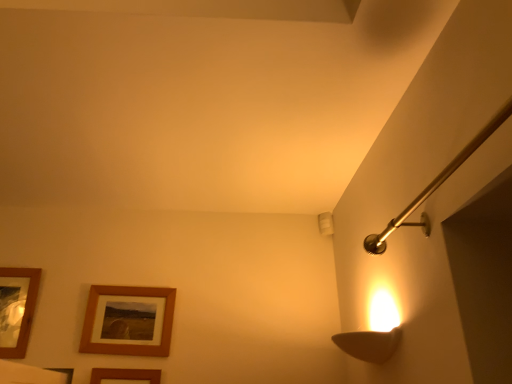
Question: From the image's perspective, would you say brown wooden picture frame at lower left, marked as the third picture frame in a left-to-right arrangement, is positioned over woodenobject at lower left, arranged as the second picture frame when viewed from the right?

Choices:
 (A) yes
 (B) no

Answer: (B)

Question: Can you confirm if brown wooden picture frame at lower left, which appears as the first picture frame when viewed from the right, is positioned to the left of woodenobject at lower left, placed as the 2th picture frame when sorted from left to right?

Choices:
 (A) no
 (B) yes

Answer: (A)

Question: Is woodenobject at lower left, arranged as the second picture frame when viewed from the right, surrounded by brown wooden picture frame at lower left, marked as the third picture frame in a left-to-right arrangement?

Choices:
 (A) no
 (B) yes

Answer: (A)

Question: Does brown wooden picture frame at lower left, marked as the third picture frame in a left-to-right arrangement, lie behind woodenobject at lower left, arranged as the second picture frame when viewed from the right?

Choices:
 (A) no
 (B) yes

Answer: (A)

Question: From a real-world perspective, is brown wooden picture frame at lower left, which appears as the first picture frame when viewed from the right, positioned under woodenobject at lower left, arranged as the second picture frame when viewed from the right, based on gravity?

Choices:
 (A) no
 (B) yes

Answer: (B)

Question: From a real-world perspective, is woodenobject at lower left, placed as the 2th picture frame when sorted from left to right, positioned above or below brown wooden picture frame at lower left, which appears as the first picture frame when viewed from the right?

Choices:
 (A) below
 (B) above

Answer: (B)

Question: In the image, is woodenobject at lower left, placed as the 2th picture frame when sorted from left to right, positioned in front of or behind brown wooden picture frame at lower left, marked as the third picture frame in a left-to-right arrangement?

Choices:
 (A) behind
 (B) front

Answer: (A)

Question: Is woodenobject at lower left, placed as the 2th picture frame when sorted from left to right, to the left or to the right of brown wooden picture frame at lower left, marked as the third picture frame in a left-to-right arrangement, in the image?

Choices:
 (A) left
 (B) right

Answer: (A)

Question: Looking at their shapes, would you say woodenobject at lower left, arranged as the second picture frame when viewed from the right, is wider or thinner than brown wooden picture frame at lower left, marked as the third picture frame in a left-to-right arrangement?

Choices:
 (A) wide
 (B) thin

Answer: (A)

Question: Which is correct: brown wooden picture frame at lower left, which appears as the first picture frame when viewed from the right, is inside woodenobject at lower left, arranged as the second picture frame when viewed from the right, or outside of it?

Choices:
 (A) inside
 (B) outside

Answer: (B)

Question: Is brown wooden picture frame at lower left, marked as the third picture frame in a left-to-right arrangement, to the left or to the right of woodenobject at lower left, arranged as the second picture frame when viewed from the right, in the image?

Choices:
 (A) right
 (B) left

Answer: (A)

Question: Is brown wooden picture frame at lower left, which appears as the first picture frame when viewed from the right, in front of or behind woodenobject at lower left, placed as the 2th picture frame when sorted from left to right, in the image?

Choices:
 (A) behind
 (B) front

Answer: (B)

Question: From the image's perspective, is brown wooden picture frame at lower left, which appears as the first picture frame when viewed from the right, above or below woodenobject at lower left, arranged as the second picture frame when viewed from the right?

Choices:
 (A) above
 (B) below

Answer: (B)

Question: From the image's perspective, relative to brown wooden picture frame at lower left, which appears as the first picture frame when viewed from the right, is wooden framed picture at lower left, which ranks as the 3th picture frame in right-to-left order, above or below?

Choices:
 (A) below
 (B) above

Answer: (B)

Question: Is point (4, 289) closer or farther from the camera than point (137, 369)?

Choices:
 (A) closer
 (B) farther

Answer: (B)